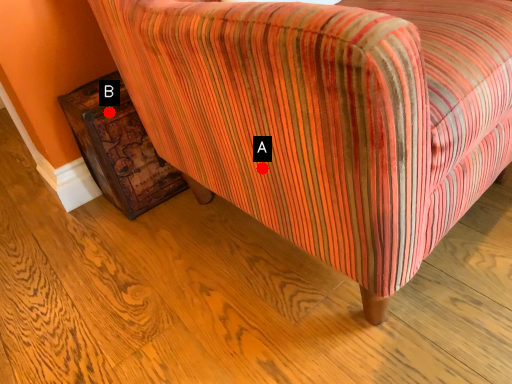
Question: Two points are circled on the image, labeled by A and B beside each circle. Which point is farther to the camera?

Choices:
 (A) A is further
 (B) B is further

Answer: (B)